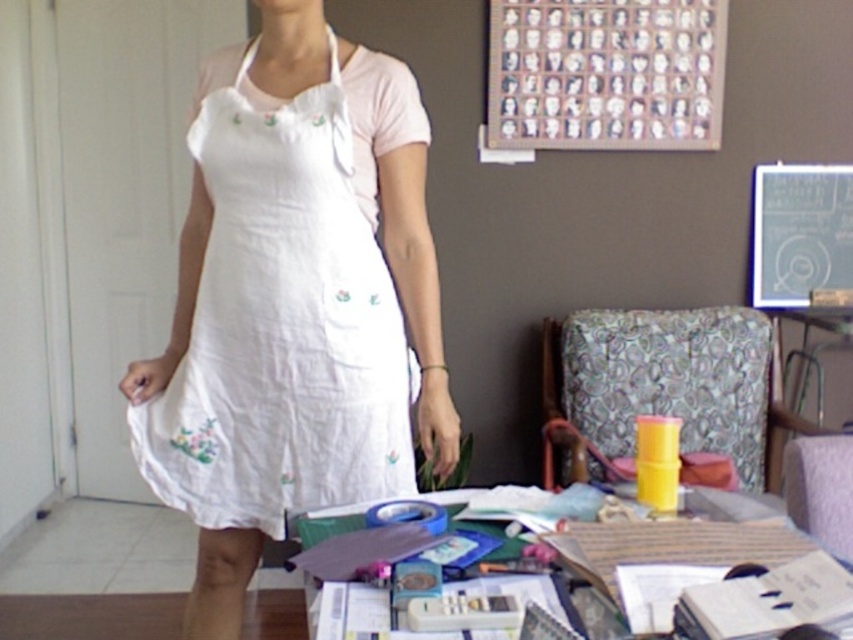
You are a guest in a room and see the white cotton dress at center and the blackboard at upper center. Which object is closer to the floor?

The white cotton dress at center is closer to the floor since it is positioned under the blackboard at upper center.

You are standing in the same room as the person in the image. You notice two points marked in the scene. Point A is located at coordinates point (231, 392) and Point B is at point (709, 33). Which point is nearer to you?

Point A at point (231, 392) is closer to you than Point B at point (709, 33).